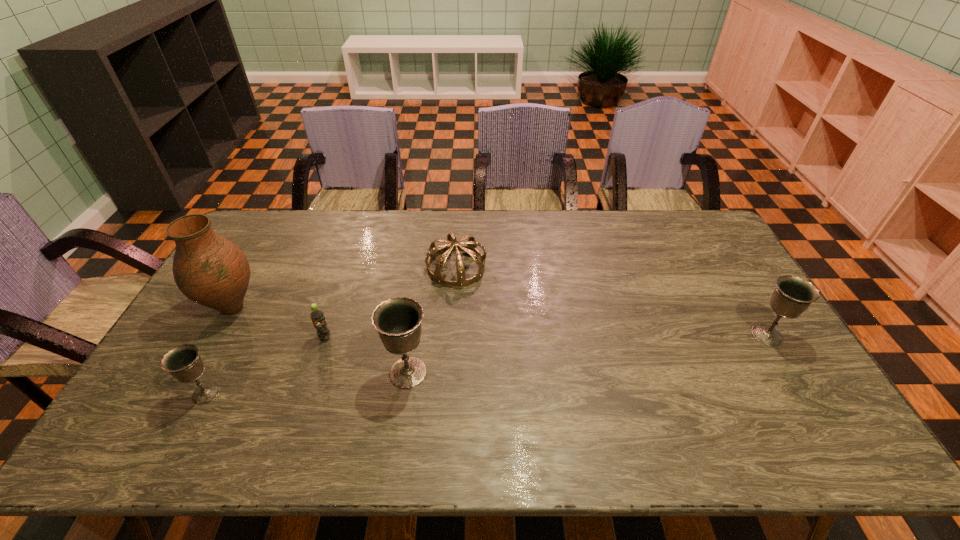
Identify the location of free space between the leftmost chalice and the tallest chalice. (307, 383).

Locate an element on the screen. free point between the second chalice from right to left and the fourth object from right to left is located at coordinates 367,355.

Locate an element on the screen. The width and height of the screenshot is (960, 540). unoccupied position between the rightmost chalice and the leftmost chalice is located at coordinates (487, 364).

You are a GUI agent. You are given a task and a screenshot of the screen. Output one action in this format:
    pyautogui.click(x=<x>, y=<y>)
    Task: Click on the free point between the shortest chalice and the rightmost object
    The height and width of the screenshot is (540, 960).
    Given the screenshot: What is the action you would take?
    pyautogui.click(x=487, y=364)

This screenshot has width=960, height=540. I want to click on object that ranks as the fourth closest to the farthest chalice, so click(x=210, y=270).

Locate an element on the screen. The height and width of the screenshot is (540, 960). object that is the closest to the leftmost chalice is located at coordinates (210, 270).

Identify which chalice is the closest to the leftmost chalice. Please provide its 2D coordinates. Your answer should be formatted as a tuple, i.e. [(x, y)], where the tuple contains the x and y coordinates of a point satisfying the conditions above.

[(398, 320)]

Locate which chalice is the closest to the shortest chalice. Please provide its 2D coordinates. Your answer should be formatted as a tuple, i.e. [(x, y)], where the tuple contains the x and y coordinates of a point satisfying the conditions above.

[(398, 320)]

Find the location of a particular element. This screenshot has height=540, width=960. free space that satisfies the following two spatial constraints: 1. on the front label of the fourth object from right to left; 2. on the left side of the tallest chalice is located at coordinates (314, 373).